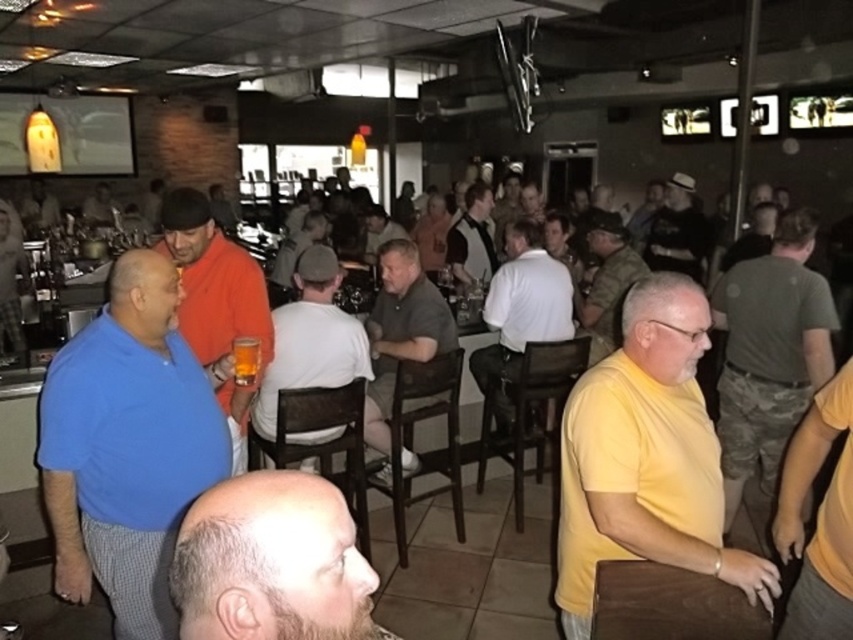
Who is positioned more to the left, white cotton shirt at center or white jersey at center?

white cotton shirt at center is more to the left.

Does white cotton shirt at center have a larger size compared to white jersey at center?

No, white cotton shirt at center is not bigger than white jersey at center.

Between point (325, 384) and point (477, 260), which one is positioned in front?

Positioned in front is point (325, 384).

The image size is (853, 640). Find the location of `white cotton shirt at center`. white cotton shirt at center is located at coordinates (311, 339).

Does yellow matte shirt at center come behind dark gray hat at upper right?

No, it is in front of dark gray hat at upper right.

You are a GUI agent. You are given a task and a screenshot of the screen. Output one action in this format:
    pyautogui.click(x=<x>, y=<y>)
    Task: Click on the yellow matte shirt at center
    
    Given the screenshot: What is the action you would take?
    pyautogui.click(x=646, y=458)

How distant is bald head at center from orange shirt at center?

bald head at center and orange shirt at center are 9.27 meters apart from each other.

The height and width of the screenshot is (640, 853). What do you see at coordinates (271, 563) in the screenshot?
I see `bald head at center` at bounding box center [271, 563].

Image resolution: width=853 pixels, height=640 pixels. What do you see at coordinates (271, 563) in the screenshot?
I see `bald head at center` at bounding box center [271, 563].

Image resolution: width=853 pixels, height=640 pixels. Find the location of `bald head at center`. bald head at center is located at coordinates (271, 563).